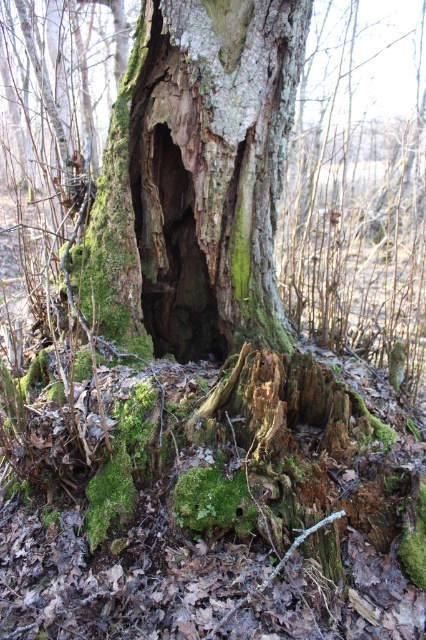
Question: Which point is closer to the camera taking this photo?

Choices:
 (A) (137, 22)
 (B) (256, 180)

Answer: (B)

Question: Observing the image, what is the correct spatial positioning of green mossy bark at center in reference to green mossy tree trunk at center?

Choices:
 (A) below
 (B) above

Answer: (A)

Question: Among these points, which one is nearest to the camera?

Choices:
 (A) (109, 330)
 (B) (195, 291)

Answer: (A)

Question: Is green mossy bark at center positioned before green mossy tree trunk at center?

Choices:
 (A) no
 (B) yes

Answer: (B)

Question: Is green mossy bark at center bigger than green mossy tree trunk at center?

Choices:
 (A) no
 (B) yes

Answer: (B)